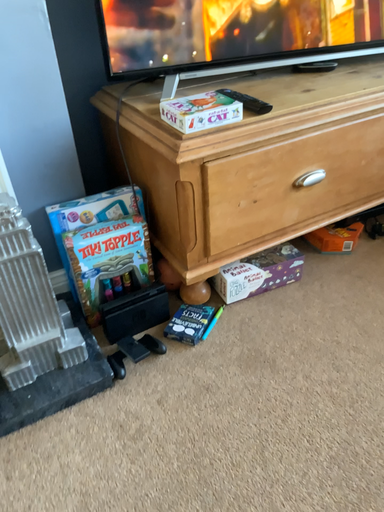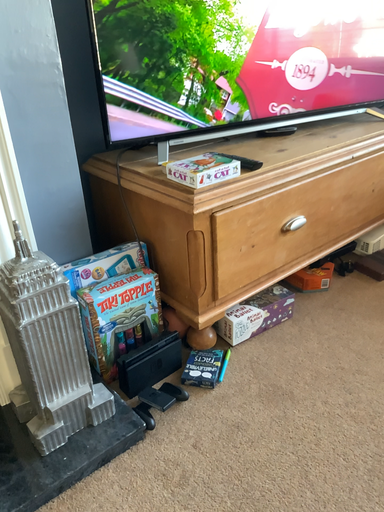
Question: Which way did the camera rotate in the video?

Choices:
 (A) rotated upward
 (B) rotated downward

Answer: (A)